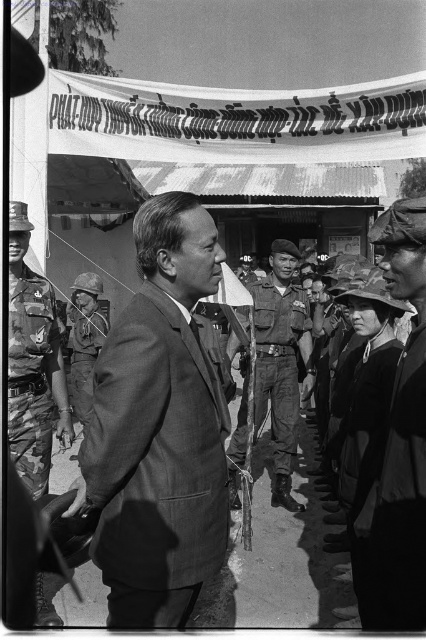
You are standing at the point labeled as point [46,310] and want to walk to the point labeled as point [408,378]. Which direction should you move relative to your current position?

Since point [408,378] is closer to the viewer than point [46,310], you should move forward towards the point [408,378].

You are a photographer standing in the scene. You want to take a photo of the dark gray uniform at center and camouflage fabric helmet at center. Can you fit both objects in the frame of your camera without moving your position? Assume your camera has a field of view that can capture objects within a 2.5 meter width at this distance.

The dark gray uniform at center and camouflage fabric helmet at center are 3.04 meters apart, so no, you cannot fit both objects in the frame without moving your position since the distance between them exceeds the camera field of view of 2.5 meters.

You are a photographer analyzing this historical image. You notice two individuals at the center of the scene wearing uniforms. The first is described as a dark gray uniform at center, and the second is a uniformed soldier at center. Based on the spatial details provided, which of these two uniforms is narrower in width?

The dark gray uniform at center is narrower in width compared to the uniformed soldier at center, as stated in the object descriptions.